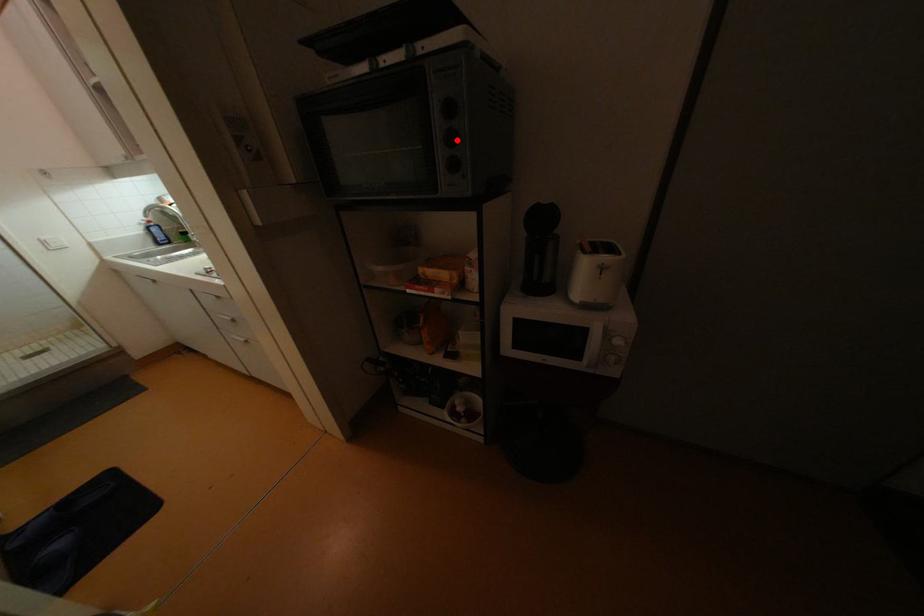
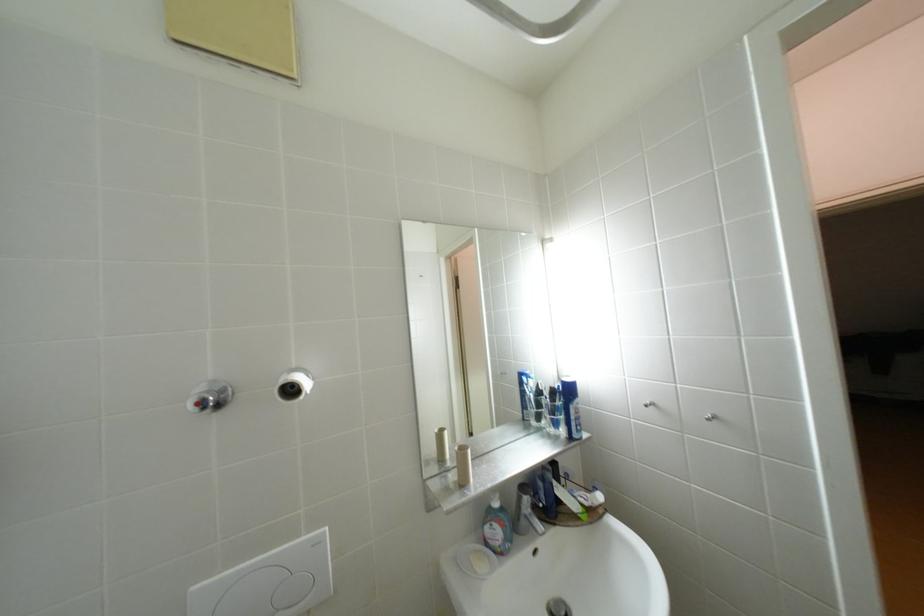
Question: I am providing you with two images of the same scene from different viewpoints. A red point is marked on the first image. Can you still see the location of the red point in image 2?

Choices:
 (A) Yes
 (B) No

Answer: (B)